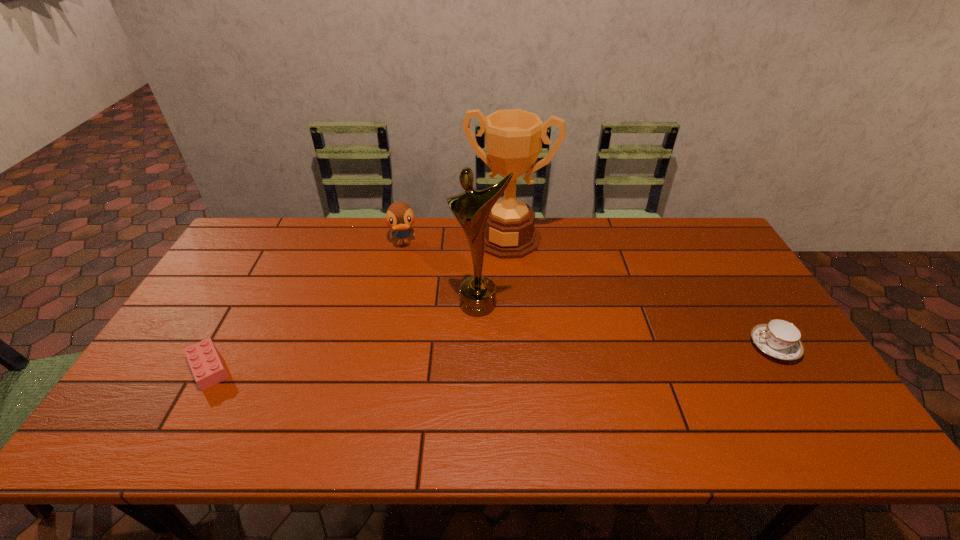
Image resolution: width=960 pixels, height=540 pixels. I want to click on free space located on the side with the handle of the second shortest object, so click(636, 347).

Locate an element on the screen. Image resolution: width=960 pixels, height=540 pixels. vacant point located 0.240m on the side with the handle of the second shortest object is located at coordinates (660, 347).

Where is `free space located 0.250m on the front-facing side of the farther award`? This screenshot has width=960, height=540. free space located 0.250m on the front-facing side of the farther award is located at coordinates (477, 312).

What are the coordinates of `vacant region located on the front-facing side of the farther award` in the screenshot? It's located at (470, 329).

I want to click on free space located on the front-facing side of the farther award, so click(x=493, y=269).

At what (x,y) coordinates should I click in order to perform the action: click on free spot located on the front-facing side of the duck. Please return your answer as a coordinate pair (x, y). Looking at the image, I should click on (408, 305).

Where is `free space located 0.300m on the front-facing side of the duck`? The image size is (960, 540). free space located 0.300m on the front-facing side of the duck is located at coordinates (409, 320).

The height and width of the screenshot is (540, 960). What are the coordinates of `vacant space located on the front-facing side of the duck` in the screenshot? It's located at (410, 325).

Image resolution: width=960 pixels, height=540 pixels. I want to click on vacant area located 0.160m on the front-facing side of the nearer award, so click(x=448, y=360).

Find the location of `free space located 0.050m on the front-facing side of the nearer award`. free space located 0.050m on the front-facing side of the nearer award is located at coordinates (464, 329).